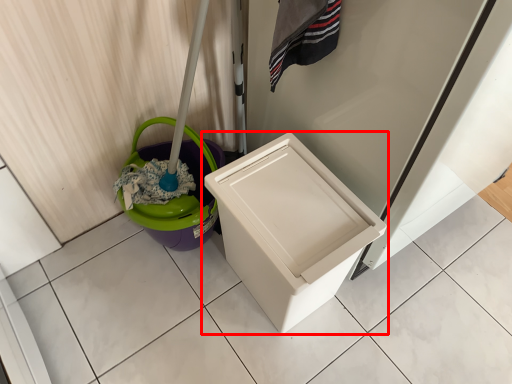
Question: In this image, where is waste container (annotated by the red box) located relative to potty?

Choices:
 (A) right
 (B) left

Answer: (A)